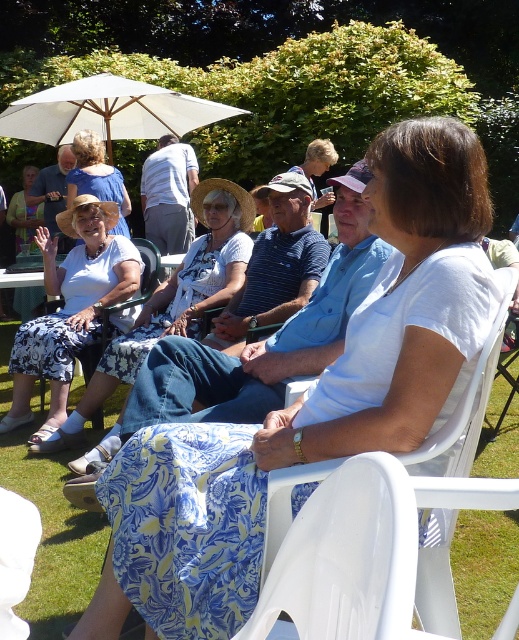
Is point (324, 444) more distant than point (121, 230)?

No, it is not.

Who is more distant from viewer, (271,461) or (80,180)?

Point (80,180)

Between point (425, 413) and point (75, 161), which one is positioned in front?

Positioned in front is point (425, 413).

Where is `white fabric dress at center`? white fabric dress at center is located at coordinates (308, 403).

Is white fabric dress at center to the left of matte white blouse at center from the viewer's perspective?

No, white fabric dress at center is not to the left of matte white blouse at center.

Does white fabric dress at center come behind matte white blouse at center?

No, it is not.

Image resolution: width=519 pixels, height=640 pixels. Describe the element at coordinates (308, 403) in the screenshot. I see `white fabric dress at center` at that location.

Find the location of a particular element. This screenshot has width=519, height=640. white fabric dress at center is located at coordinates (308, 403).

Is white fabric umbrella at upper left positioned behind matte white blouse at center?

That is False.

Is white fabric umbrella at upper left smaller than matte white blouse at center?

No, white fabric umbrella at upper left is not smaller than matte white blouse at center.

The height and width of the screenshot is (640, 519). Find the location of `white fabric umbrella at upper left`. white fabric umbrella at upper left is located at coordinates (108, 112).